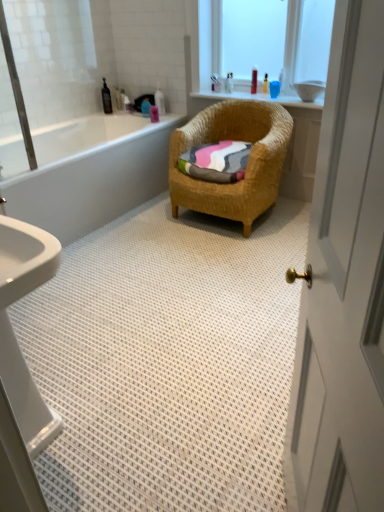
Where is `free spot to the left of translucent plastic bottle at upper center, which is the 7th toiletry from left to right`? The height and width of the screenshot is (512, 384). free spot to the left of translucent plastic bottle at upper center, which is the 7th toiletry from left to right is located at coordinates point(236,94).